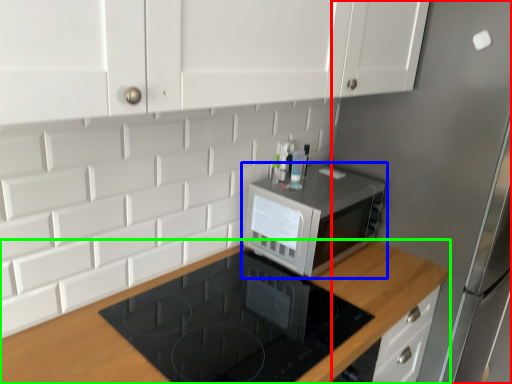
Question: Which object is the closest to the fridge (highlighted by a red box)? Choose among these: microwave oven (highlighted by a blue box) or countertop (highlighted by a green box).

Choices:
 (A) microwave oven
 (B) countertop

Answer: (A)